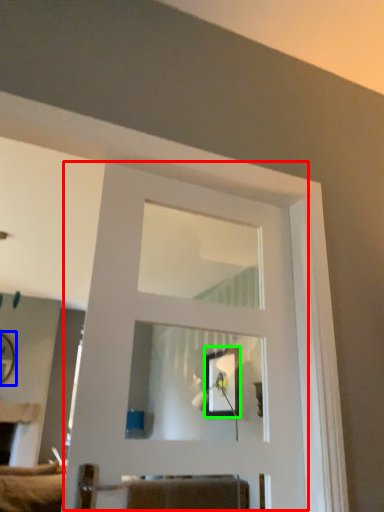
Question: Which object is positioned farthest from door (highlighted by a red box)? Select from mirror (highlighted by a blue box) and picture frame (highlighted by a green box).

Choices:
 (A) mirror
 (B) picture frame

Answer: (A)